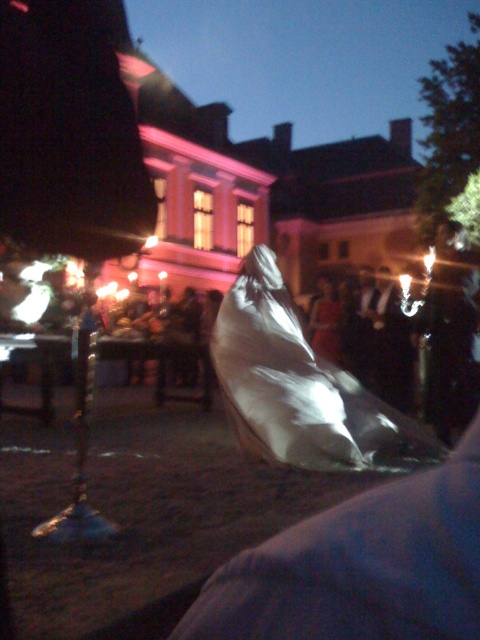
Question: Can you confirm if shiny metallic foil at center is thinner than silky white fabric at center?

Choices:
 (A) yes
 (B) no

Answer: (A)

Question: Does shiny metallic foil at center have a smaller size compared to silky white fabric at center?

Choices:
 (A) yes
 (B) no

Answer: (A)

Question: Can you confirm if shiny metallic foil at center is positioned above silky white fabric at center?

Choices:
 (A) no
 (B) yes

Answer: (A)

Question: Which point is farther to the camera?

Choices:
 (A) shiny metallic foil at center
 (B) silky white fabric at center

Answer: (B)